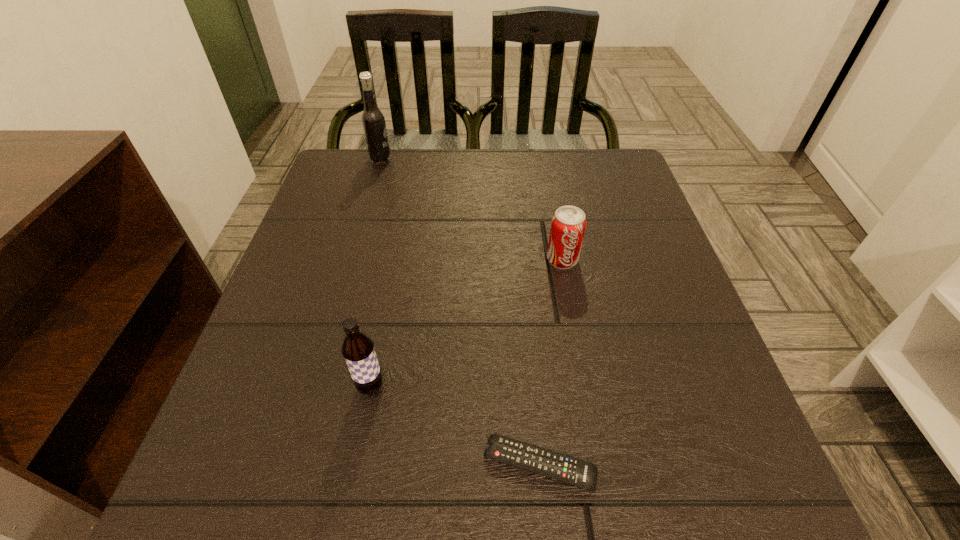
At what (x,y) coordinates should I click in order to perform the action: click on free space located on the right of the second shortest object. Please return your answer as a coordinate pair (x, y). The image size is (960, 540). Looking at the image, I should click on (621, 260).

Where is `free space located on the back of the nearest object`? The width and height of the screenshot is (960, 540). free space located on the back of the nearest object is located at coordinates (529, 354).

Find the location of a particular element. This screenshot has width=960, height=540. object at the far edge is located at coordinates (373, 120).

Locate an element on the screen. This screenshot has width=960, height=540. object that is at the near edge is located at coordinates (545, 462).

Where is `object that is positioned at the left edge`? The width and height of the screenshot is (960, 540). object that is positioned at the left edge is located at coordinates pos(373,120).

Identify the location of object that is at the far left corner. The height and width of the screenshot is (540, 960). (373, 120).

In the image, there is a desktop. What are the coordinates of `vacant space at the far edge` in the screenshot? It's located at (558, 194).

This screenshot has height=540, width=960. In order to click on vacant space at the left edge of the desktop in this screenshot , I will do `click(358, 206)`.

Where is `vacant area at the right edge`? This screenshot has height=540, width=960. vacant area at the right edge is located at coordinates (630, 241).

Where is `vacant space at the far left corner of the desktop`? The image size is (960, 540). vacant space at the far left corner of the desktop is located at coordinates (390, 163).